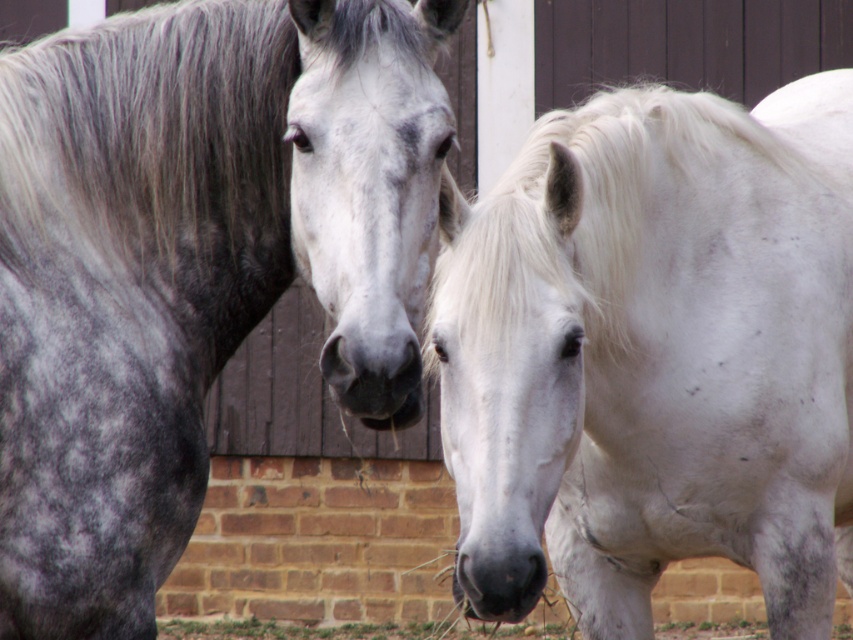
Question: Which point is farther to the camera?

Choices:
 (A) (341, 403)
 (B) (688, 328)
 (C) (287, 177)

Answer: (B)

Question: Which point is closer to the camera?

Choices:
 (A) (187, 42)
 (B) (445, 140)
 (C) (610, 152)
 (D) (321, 355)

Answer: (B)

Question: Does white matte horse at center appear over gray silky mane at center?

Choices:
 (A) no
 (B) yes

Answer: (A)

Question: Among these points, which one is farthest from the camera?

Choices:
 (A) (656, 550)
 (B) (380, 422)

Answer: (A)

Question: Observing the image, what is the correct spatial positioning of gray silky mane at center in reference to gray matte nose at center?

Choices:
 (A) left
 (B) right

Answer: (A)

Question: Can you confirm if gray silky mane at center is wider than gray matte nose at center?

Choices:
 (A) no
 (B) yes

Answer: (B)